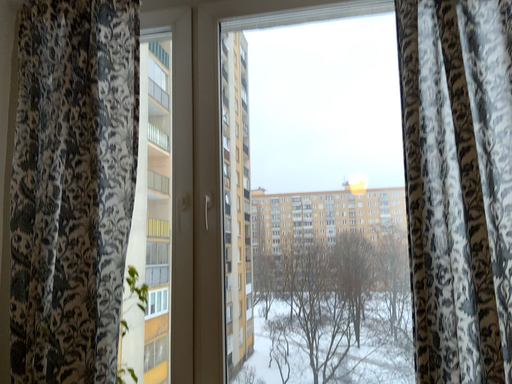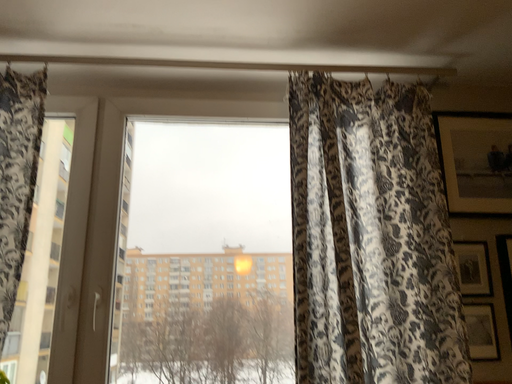
Question: How did the camera likely rotate when shooting the video?

Choices:
 (A) rotated left
 (B) rotated right

Answer: (B)